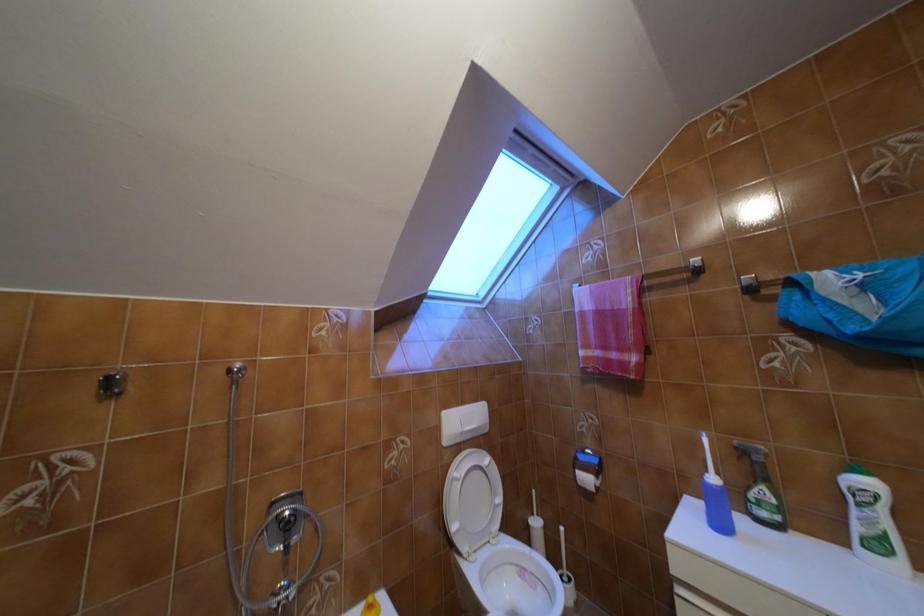
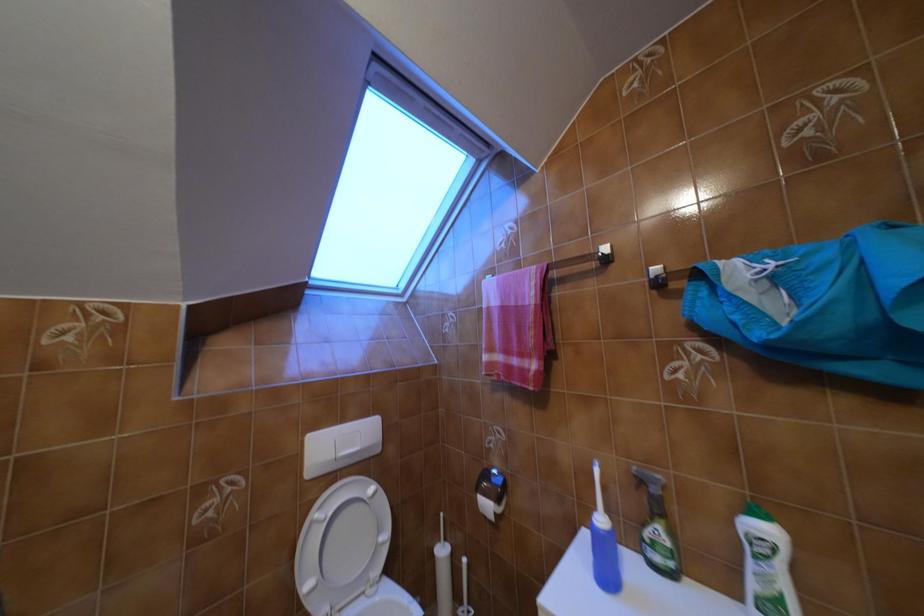
What movement of the cameraman would produce the second image?

The cameraman moved toward right, forward.